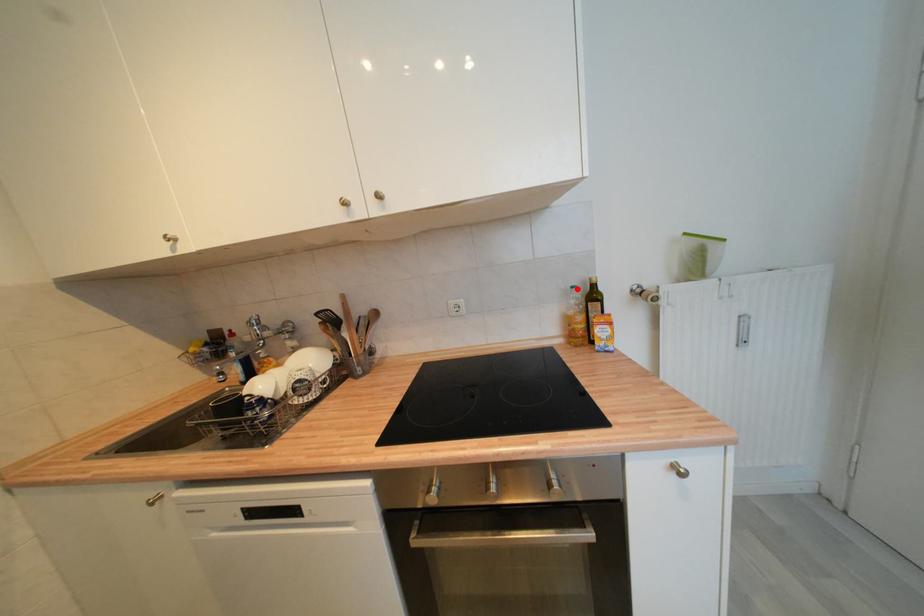
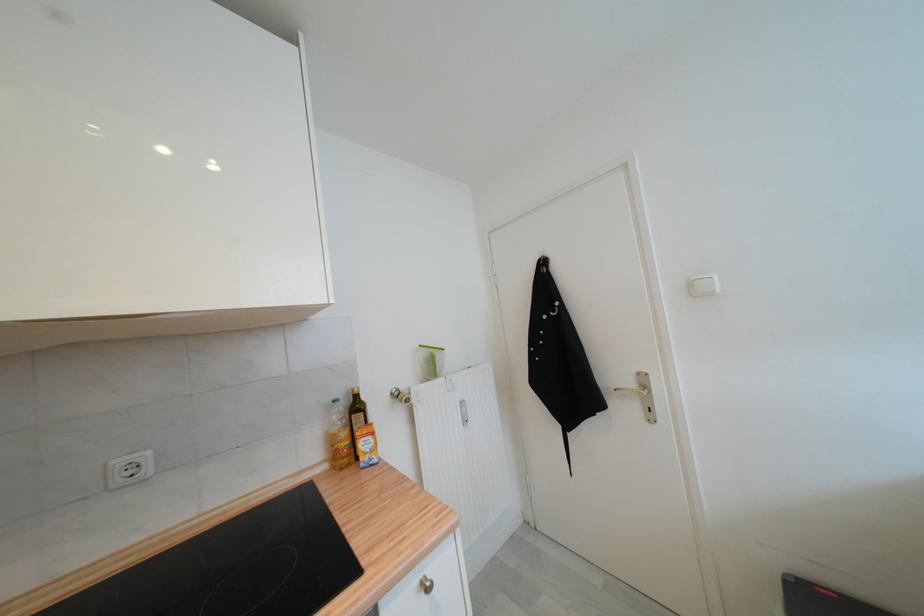
Question: I am providing you with two images of the same scene from different viewpoints. A red point is marked on the first image. Can you still see the location of the red point in image 2?

Choices:
 (A) Yes
 (B) No

Answer: (A)